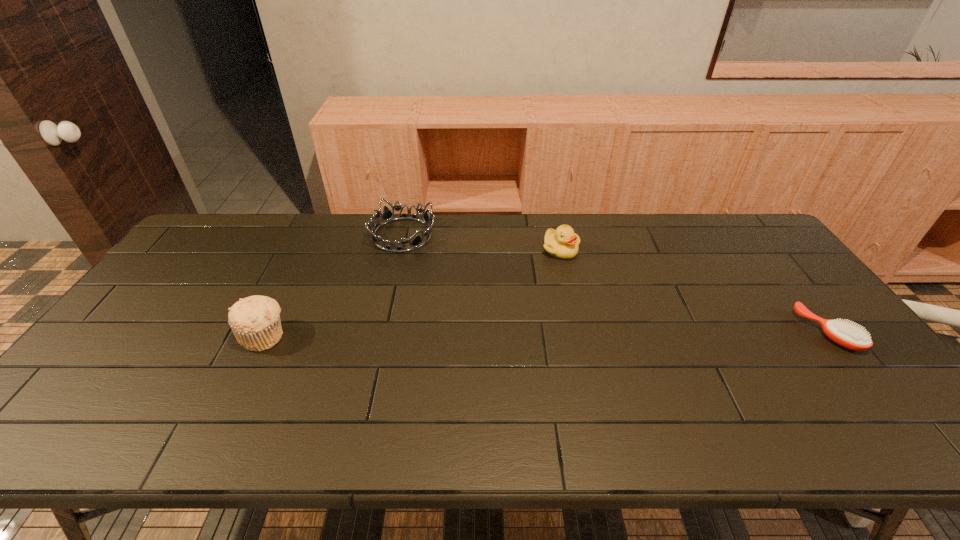
Image resolution: width=960 pixels, height=540 pixels. In order to click on free space between the tallest object and the rightmost object in this screenshot , I will do `click(546, 334)`.

What are the coordinates of `vacant space in between the third object from right to left and the duckling` in the screenshot? It's located at (482, 242).

This screenshot has width=960, height=540. What are the coordinates of `vacant space that is in between the third object from left to right and the shortest object` in the screenshot? It's located at (694, 291).

Identify the location of free area in between the third object from left to right and the shortest object. The width and height of the screenshot is (960, 540). (694, 291).

Locate which object is the closest to the muffin. Please provide its 2D coordinates. Your answer should be formatted as a tuple, i.e. [(x, y)], where the tuple contains the x and y coordinates of a point satisfying the conditions above.

[(387, 216)]

Where is `the third closest object relative to the tallest object`? the third closest object relative to the tallest object is located at coordinates (845, 334).

I want to click on vacant space that satisfies the following two spatial constraints: 1. on the front side of the duckling; 2. on the left side of the tiara, so click(399, 250).